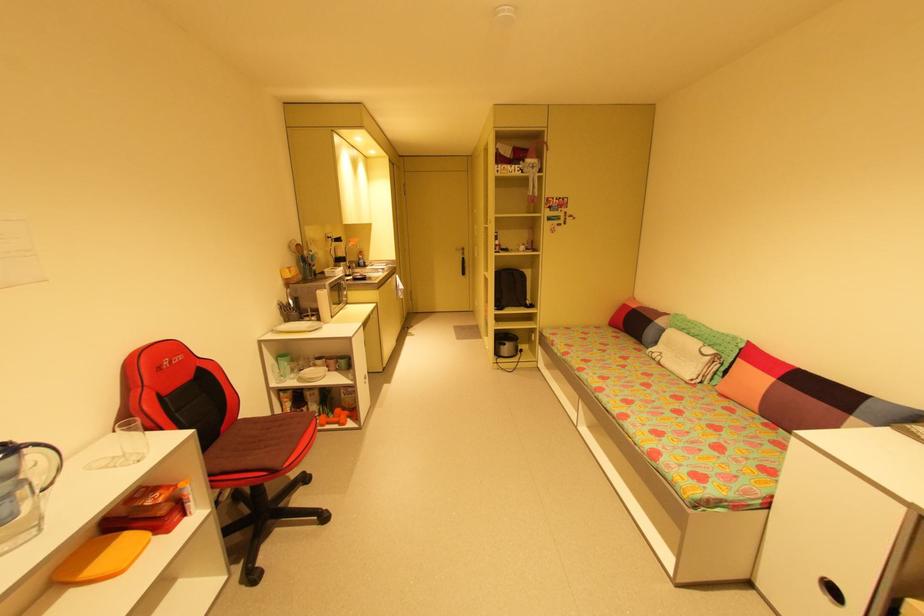
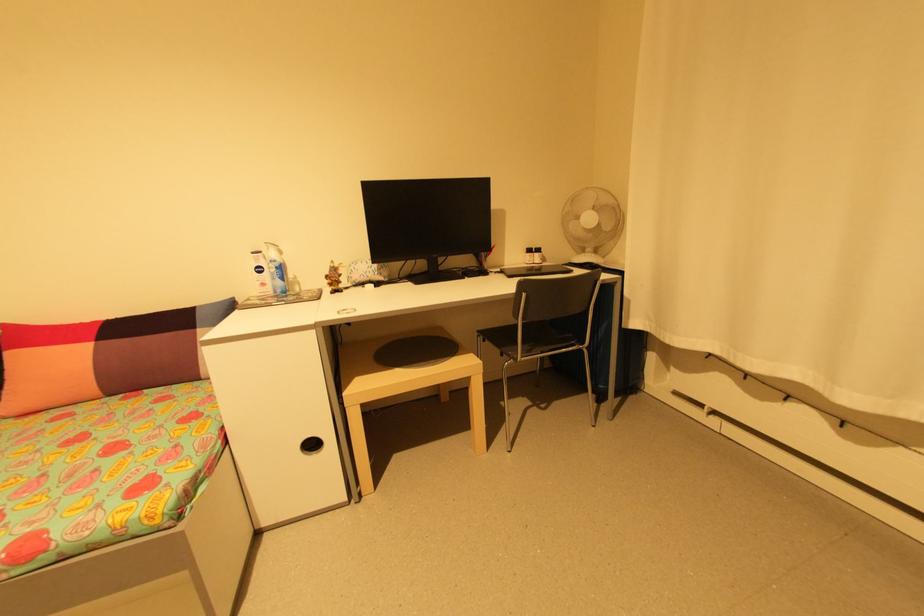
Where in the second image is the point corresponding to pixel 754 342 from the first image?

(8, 326)